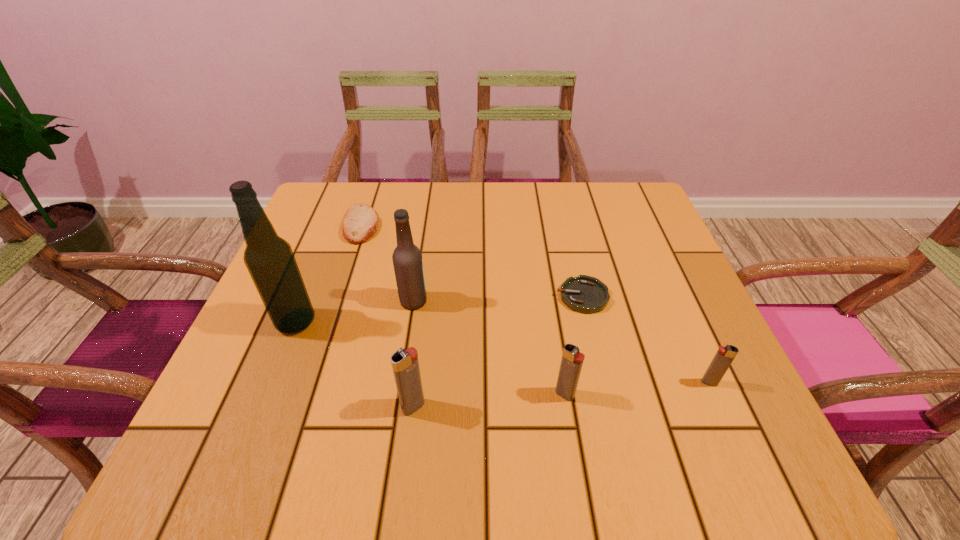
Observe the arrangement of all igniters in the image. To keep them evenly spaced, where would you place another igniter on the left? Please locate a free space. Please provide its 2D coordinates. Your answer should be formatted as a tuple, i.e. [(x, y)], where the tuple contains the x and y coordinates of a point satisfying the conditions above.

[(255, 420)]